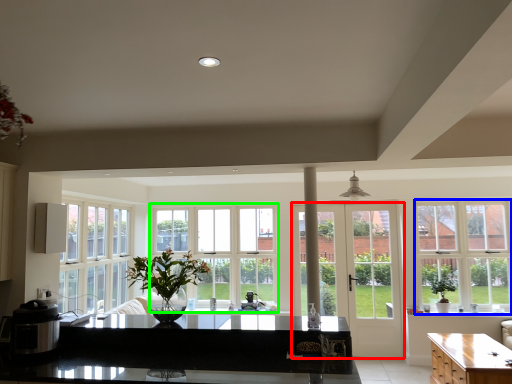
Question: Which object is the closest to the door (highlighted by a red box)? Choose among these: window (highlighted by a blue box) or window (highlighted by a green box).

Choices:
 (A) window
 (B) window

Answer: (A)